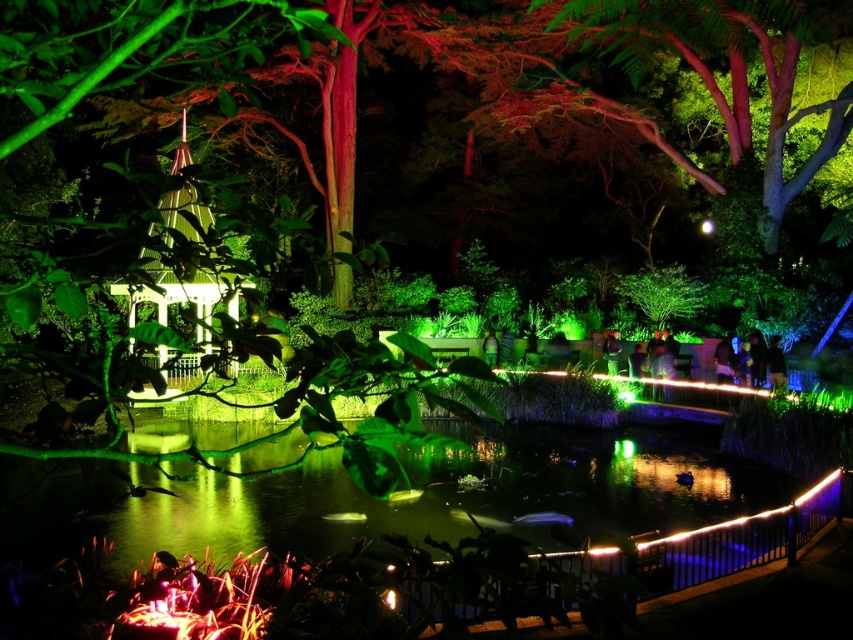
Question: In this image, where is green reflective water at center located relative to white glossy gazebo at left?

Choices:
 (A) left
 (B) right

Answer: (B)

Question: Which of the following is the farthest from the observer?

Choices:
 (A) green reflective water at center
 (B) white glossy gazebo at left

Answer: (A)

Question: Which point is farther to the camera?

Choices:
 (A) white glossy gazebo at left
 (B) green reflective water at center

Answer: (B)

Question: Is green reflective water at center thinner than white glossy gazebo at left?

Choices:
 (A) no
 (B) yes

Answer: (A)

Question: Is green reflective water at center above white glossy gazebo at left?

Choices:
 (A) yes
 (B) no

Answer: (B)